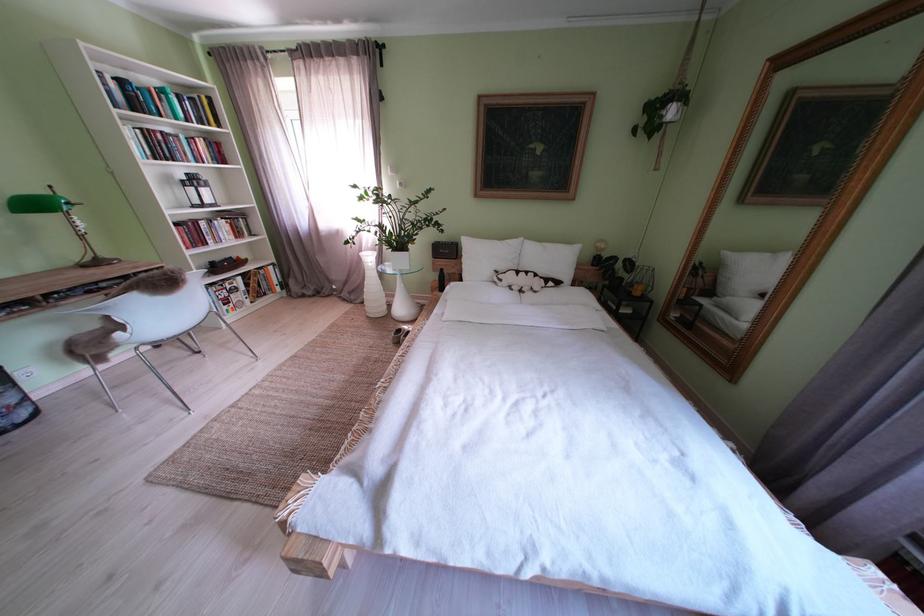
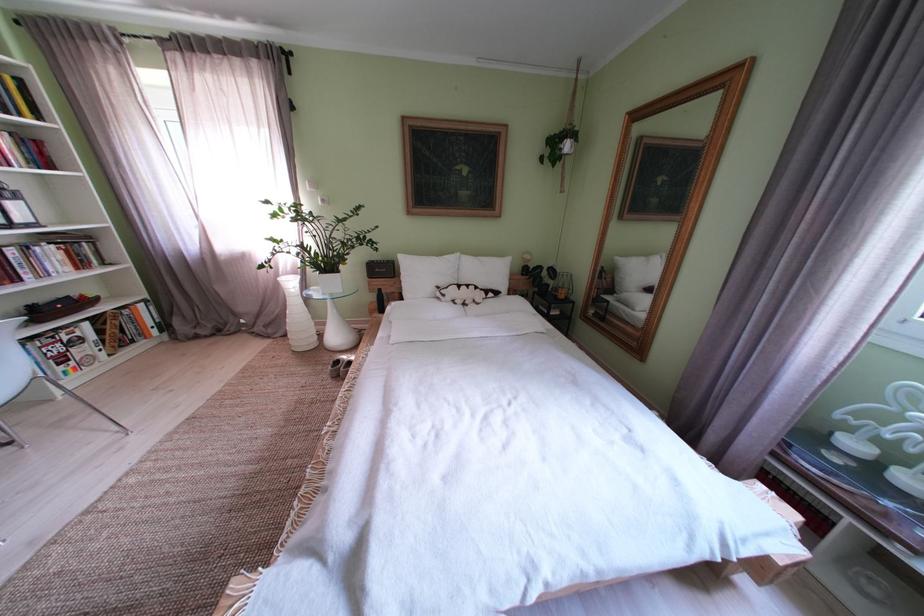
The point at [454,243] is marked in the first image. Where is the corresponding point in the second image?

(387, 262)